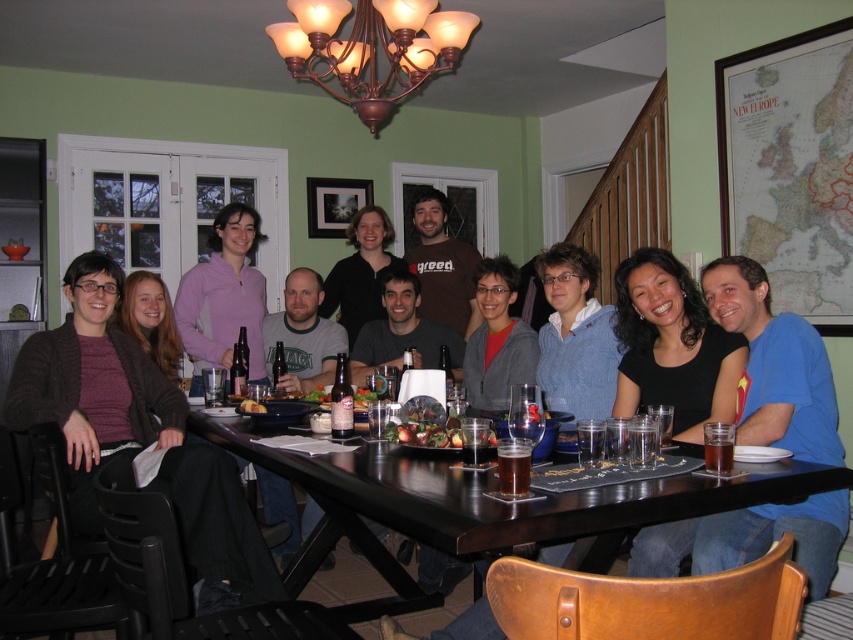
You are standing at the dining table and want to reach both the point at coordinates [485,502] and the point at coordinates [732,449]. Which point will you reach first?

You will reach the point at coordinates [485,502] first because it is closer to you than the point at coordinates [732,449].

You are a photographer who wants to capture a detailed shot of the fresh tomato salad at center and the brown glass bottle at center. Which object should you focus on first if you want to ensure both are in focus without moving the camera?

The fresh tomato salad at center is closer to the viewer than the brown glass bottle at center, so focus on the fresh tomato salad at center first to ensure both are in focus.

You are a photographer at the event and want to place a new drink on the table so that it is to the right of the black wood table at center. Where should you place the drink relative to the translucent glass beer at table center?

The black wood table at center is positioned on the left side of the translucent glass beer at table center. Therefore, to place the drink to the right of the black wood table at center, you should place it to the right of the translucent glass beer at table center.